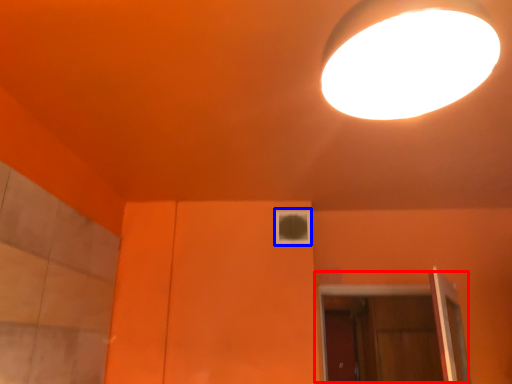
Question: Among these objects, which one is nearest to the camera, door (highlighted by a red box) or window (highlighted by a blue box)?

Choices:
 (A) door
 (B) window

Answer: (B)